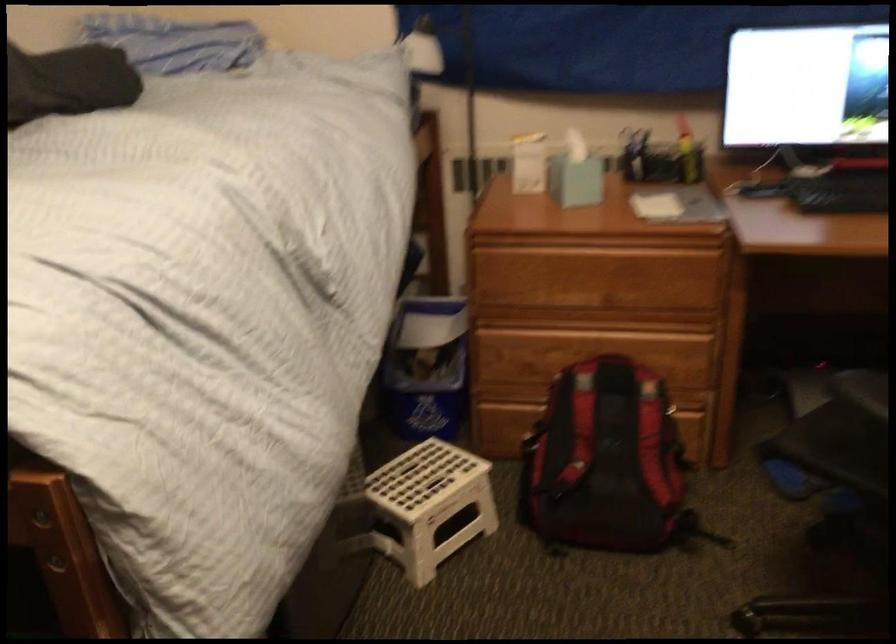
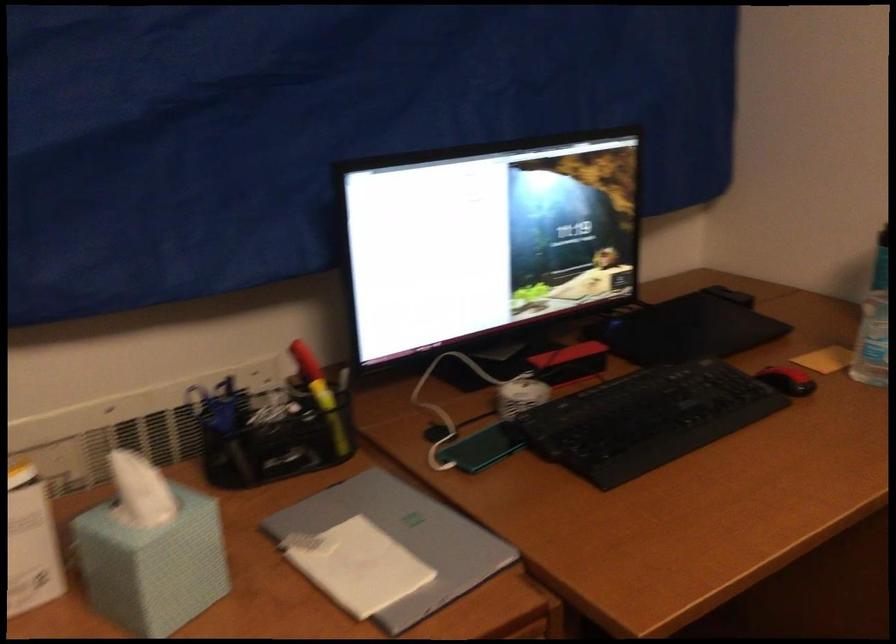
In the second image, find the point that corresponds to (572,165) in the first image.

(150, 550)